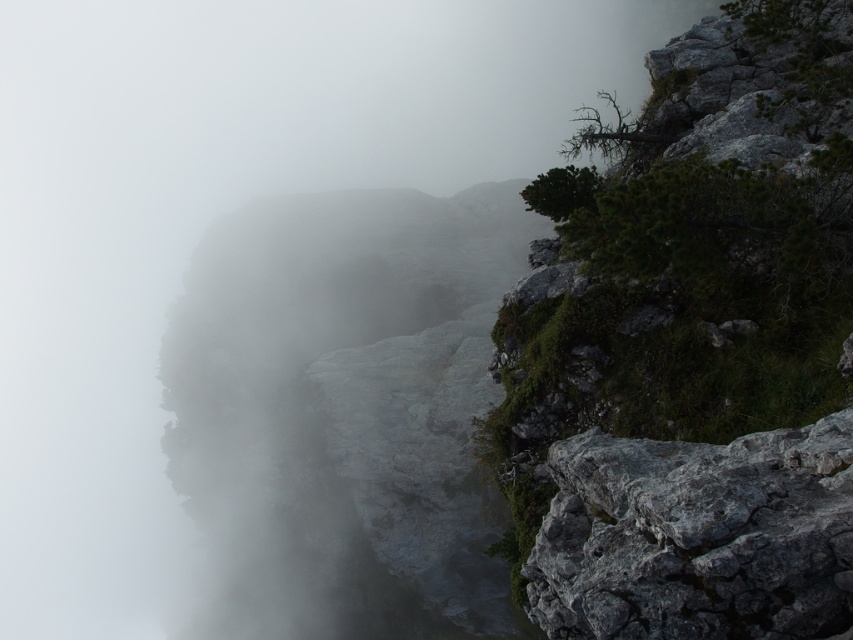
You are a hiker navigating through the misty mountain terrain. You notice a rough gray rock at right. Can you estimate its location in the image using coordinates?

The rough gray rock at right is located at coordinates point (691, 348).

Consider the image. You are a hiker trying to navigate through the misty mountains. You see the white misty cloud at left and the gray rough rock at lower right. Which object is located below the other?

The white misty cloud at left is positioned under the gray rough rock at lower right, so the cloud is below the rock.

You are a hiker trying to navigate through the rocky terrain in the misty mountain landscape. You see a rough gray rock at right and a gray rough rock at lower right. Which rock should you avoid stepping on if you want to stay on higher ground?

You should avoid stepping on the rough gray rock at right because it is located above the gray rough rock at lower right, meaning it is at a higher elevation.